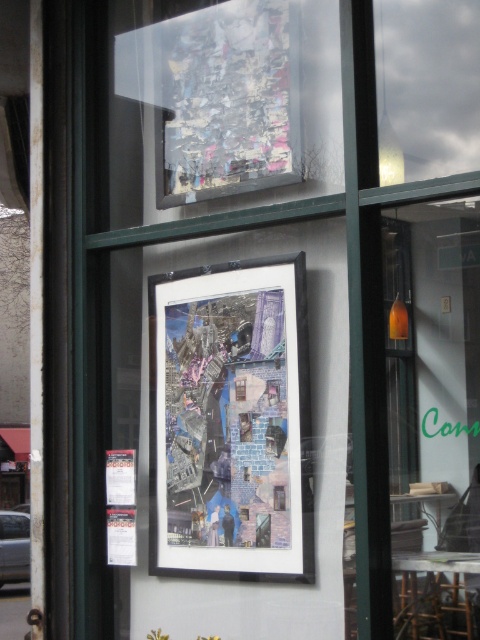
Question: Does matte black collage at center appear on the right side of metallic collage at upper center?

Choices:
 (A) no
 (B) yes

Answer: (B)

Question: Considering the relative positions of matte black collage at center and metallic collage at upper center in the image provided, where is matte black collage at center located with respect to metallic collage at upper center?

Choices:
 (A) left
 (B) right

Answer: (B)

Question: Among these objects, which one is nearest to the camera?

Choices:
 (A) metallic collage at upper center
 (B) matte black collage at center

Answer: (B)

Question: Which object appears closest to the camera in this image?

Choices:
 (A) matte black collage at center
 (B) metallic collage at upper center

Answer: (A)

Question: Can you confirm if matte black collage at center is smaller than metallic collage at upper center?

Choices:
 (A) yes
 (B) no

Answer: (B)